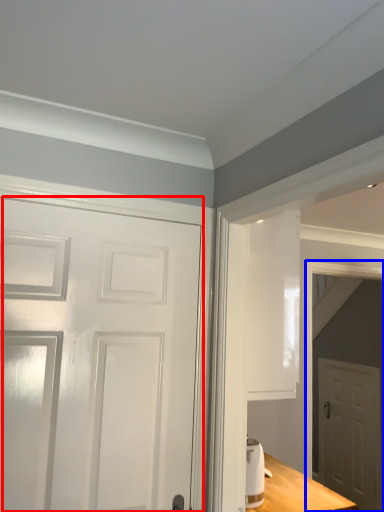
Question: Which point is further to the camera, door (highlighted by a red box) or elevator (highlighted by a blue box)?

Choices:
 (A) door
 (B) elevator

Answer: (B)